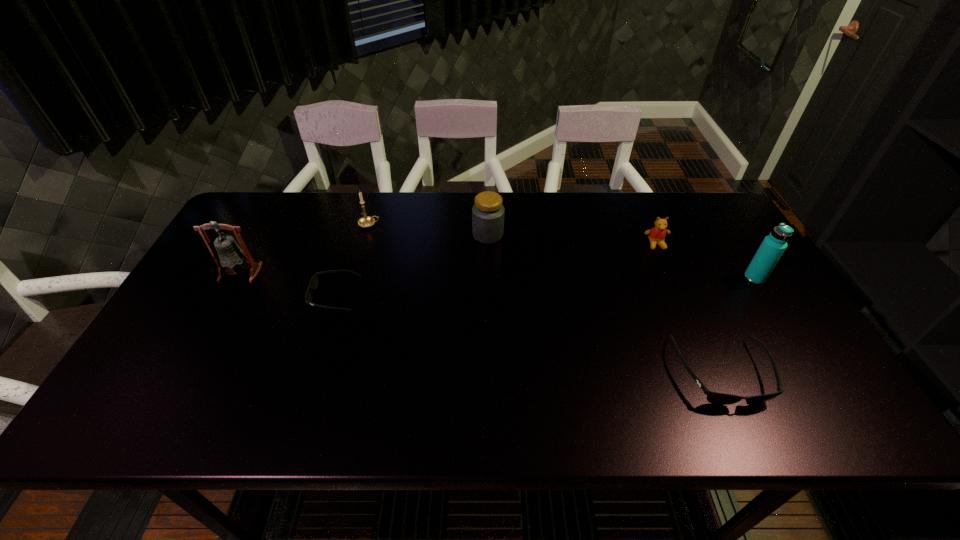
This screenshot has width=960, height=540. I want to click on the farther sunglasses, so click(x=313, y=284).

The height and width of the screenshot is (540, 960). I want to click on the shortest object, so click(x=313, y=284).

Identify the location of the sixth tallest object. (717, 398).

The width and height of the screenshot is (960, 540). I want to click on the nearest object, so click(x=717, y=398).

Locate an element on the screen. Image resolution: width=960 pixels, height=540 pixels. the fifth tallest object is located at coordinates (656, 235).

At what (x,y) coordinates should I click in order to perform the action: click on candle holder. Please return your answer as a coordinate pair (x, y). Looking at the image, I should click on (366, 221).

I want to click on the fourth object from left to right, so click(x=488, y=212).

In order to click on the rightmost object in this screenshot , I will do `click(771, 249)`.

Locate an element on the screen. This screenshot has height=540, width=960. bell is located at coordinates (229, 255).

Image resolution: width=960 pixels, height=540 pixels. Identify the location of vacant space located on the front-facing side of the shortest object. (241, 295).